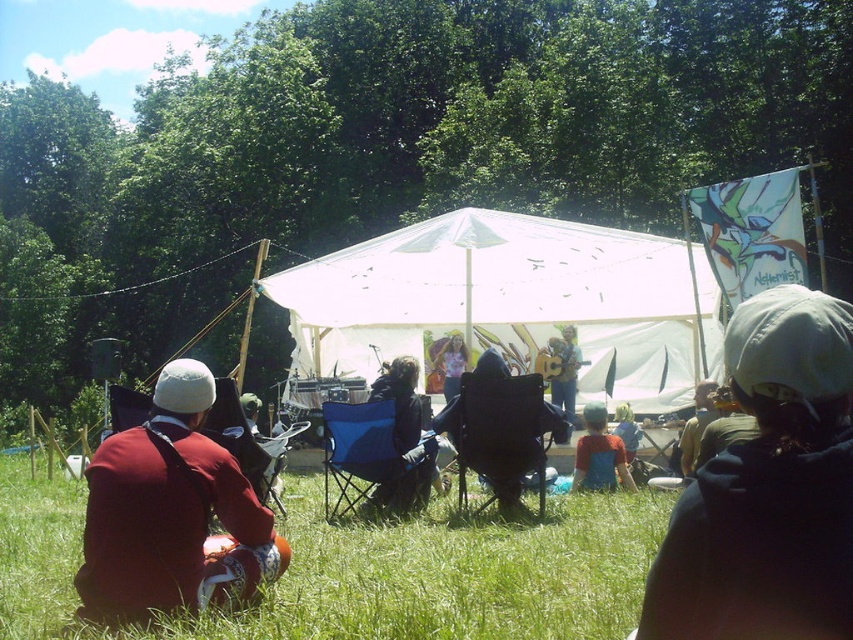
Question: Which point is farther to the camera?

Choices:
 (A) (625, 412)
 (B) (556, 394)
 (C) (599, 486)
 (D) (462, 364)

Answer: (D)

Question: Which is farther from the black fabric chair at center?

Choices:
 (A) matte pink shirt at center
 (B) blue denim shirt at center
 (C) matte red jacket at lower left
 (D) dark gray hooded sweatshirt at center

Answer: (A)

Question: Is green grassy field at lower center smaller than wooden acoustic guitar at center?

Choices:
 (A) no
 (B) yes

Answer: (A)

Question: Can you confirm if dark blue fabric chair at center is positioned to the left of blue denim shirt at center?

Choices:
 (A) yes
 (B) no

Answer: (A)

Question: Which point is farther to the camera?

Choices:
 (A) (518, 513)
 (B) (416, 426)

Answer: (B)

Question: Is blue fabric chair at center bigger than wooden acoustic guitar at center?

Choices:
 (A) no
 (B) yes

Answer: (B)